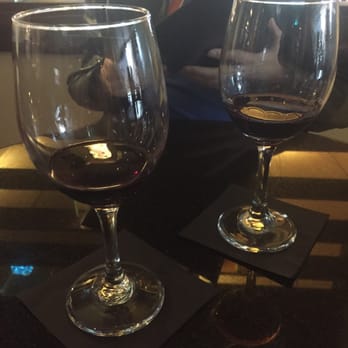
The image size is (348, 348). I want to click on stem of right wineglass, so click(263, 167).